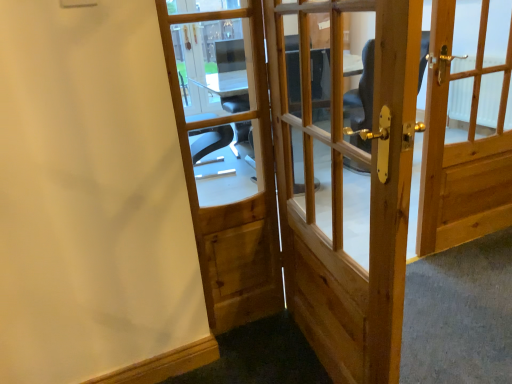
The image size is (512, 384). Find the location of `vacant space underneath natural wood door at center, which is counted as the third door, starting from the right (from a real-world perspective)`. vacant space underneath natural wood door at center, which is counted as the third door, starting from the right (from a real-world perspective) is located at coordinates point(245,312).